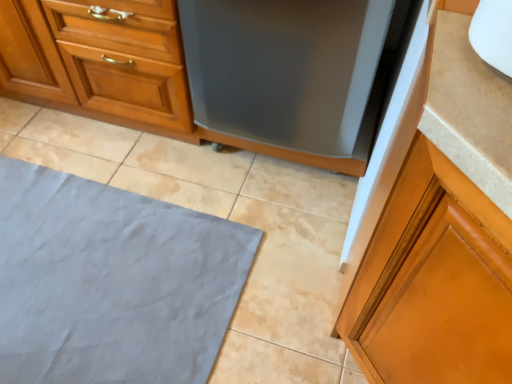
The height and width of the screenshot is (384, 512). I want to click on vacant region to the right of gray fabric bath mat at lower left, so click(x=271, y=246).